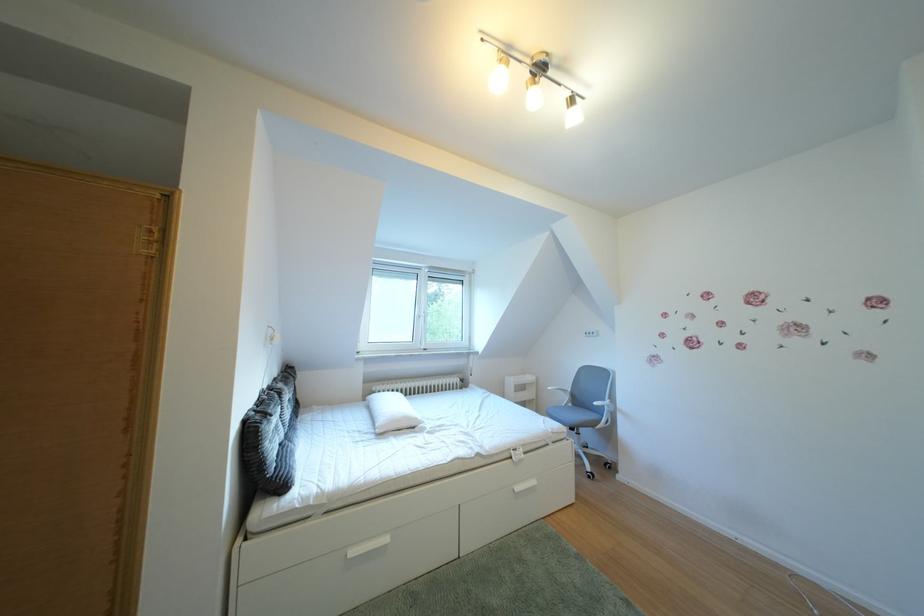
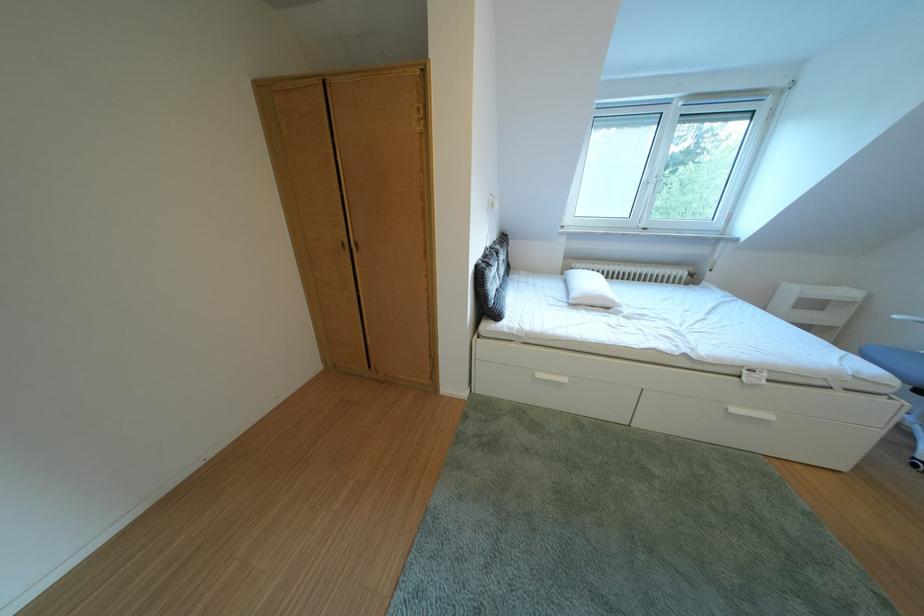
Where in the second image is the point corresponding to [530,493] from the first image?

(748, 415)